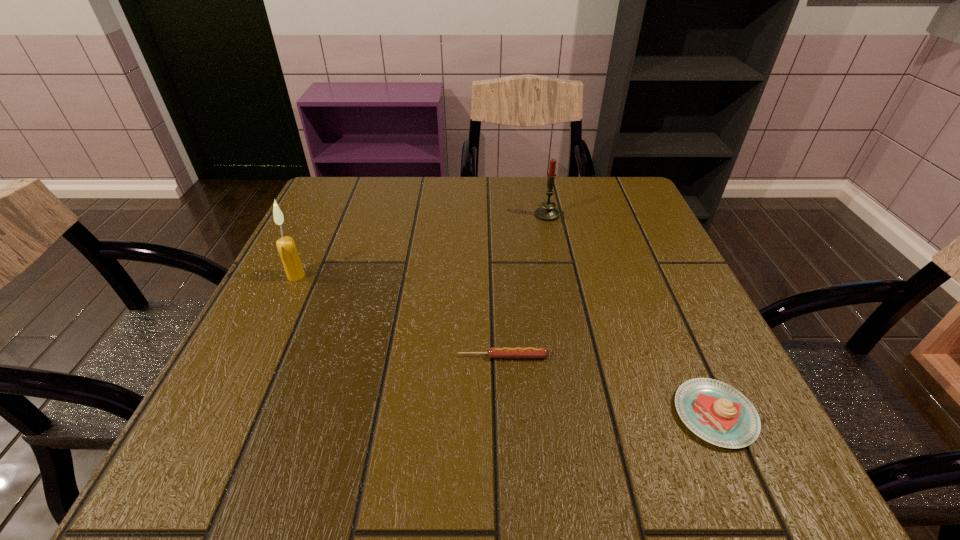
You are a GUI agent. You are given a task and a screenshot of the screen. Output one action in this format:
    pyautogui.click(x=<x>, y=<y>)
    Task: Click on the leftmost object
    The image size is (960, 540).
    Given the screenshot: What is the action you would take?
    pyautogui.click(x=286, y=247)

The image size is (960, 540). In order to click on the left candle in this screenshot , I will do `click(286, 247)`.

Identify the location of the second object from right to left. (547, 212).

You are a GUI agent. You are given a task and a screenshot of the screen. Output one action in this format:
    pyautogui.click(x=<x>, y=<y>)
    Task: Click on the right candle
    This screenshot has width=960, height=540.
    Given the screenshot: What is the action you would take?
    pyautogui.click(x=547, y=212)

Locate an element on the screen. the rightmost object is located at coordinates (718, 413).

Locate an element on the screen. pastry is located at coordinates [718, 413].

Image resolution: width=960 pixels, height=540 pixels. What are the coordinates of `sausage` in the screenshot? It's located at (495, 352).

Find the location of a particular element. the second object from left to right is located at coordinates (495, 352).

You are a GUI agent. You are given a task and a screenshot of the screen. Output one action in this format:
    pyautogui.click(x=<x>, y=<y>)
    Task: Click on the free location located on the front of the taller candle
    The image size is (960, 540).
    Given the screenshot: What is the action you would take?
    pyautogui.click(x=226, y=424)

The height and width of the screenshot is (540, 960). I want to click on blank space located 0.380m on the front of the farthest object, so click(x=574, y=343).